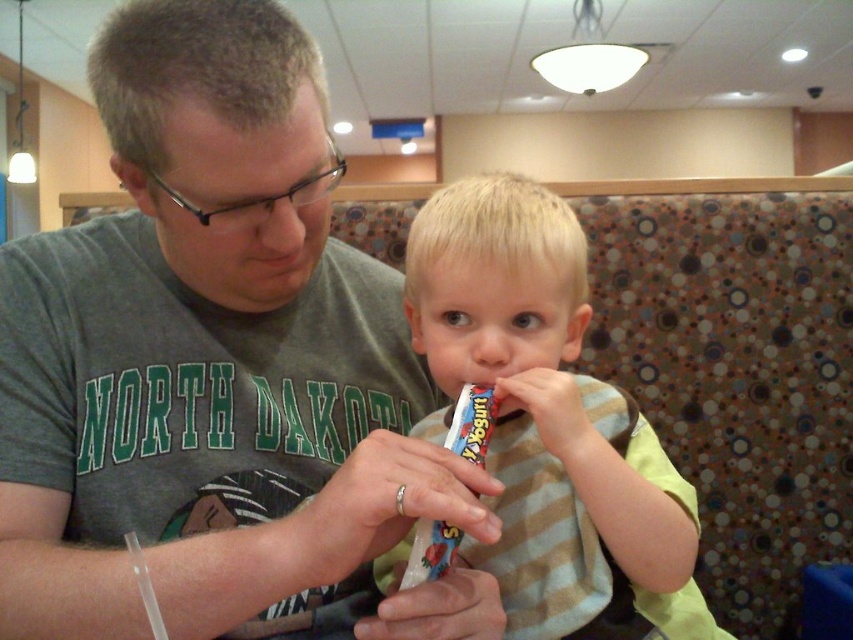
You are a customer in the restaurant and want to place your phone on the table. The table has a matte plastic yogurt at center. Where should you place your phone to avoid it?

You should place your phone away from the matte plastic yogurt at center, perhaps to the sides or edges of the table to avoid it.

You are a photographer standing in the dining area. You notice the gray matte shirt at center and the multicolored plastic toothbrush at center. Which object is positioned higher in the image?

The gray matte shirt at center is above the multicolored plastic toothbrush at center, so it is positioned higher in the image.